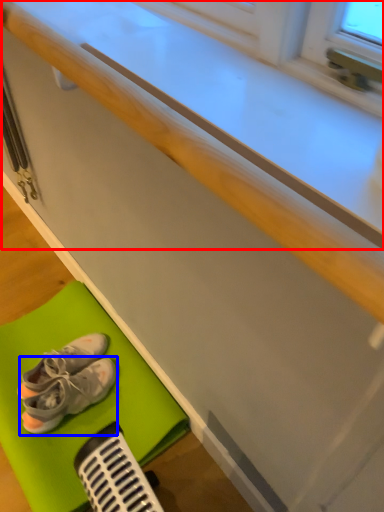
Question: Which point is further to the camera, counter top (highlighted by a red box) or footwear (highlighted by a blue box)?

Choices:
 (A) counter top
 (B) footwear

Answer: (B)